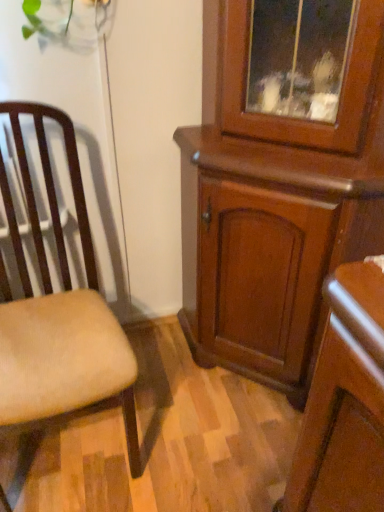
Question: Is wooden cabinet at center inside the boundaries of beige fabric chair at left, or outside?

Choices:
 (A) inside
 (B) outside

Answer: (B)

Question: From a real-world perspective, relative to beige fabric chair at left, is wooden cabinet at center vertically above or below?

Choices:
 (A) below
 (B) above

Answer: (B)

Question: Is wooden cabinet at center taller or shorter than beige fabric chair at left?

Choices:
 (A) tall
 (B) short

Answer: (A)

Question: In the image, is beige fabric chair at left on the left side or the right side of wooden cabinet at center?

Choices:
 (A) left
 (B) right

Answer: (A)

Question: Is beige fabric chair at left bigger or smaller than wooden cabinet at center?

Choices:
 (A) big
 (B) small

Answer: (B)

Question: From the image's perspective, is beige fabric chair at left located above or below wooden cabinet at center?

Choices:
 (A) below
 (B) above

Answer: (A)

Question: Considering the positions of beige fabric chair at left and wooden cabinet at center in the image, is beige fabric chair at left taller or shorter than wooden cabinet at center?

Choices:
 (A) tall
 (B) short

Answer: (B)